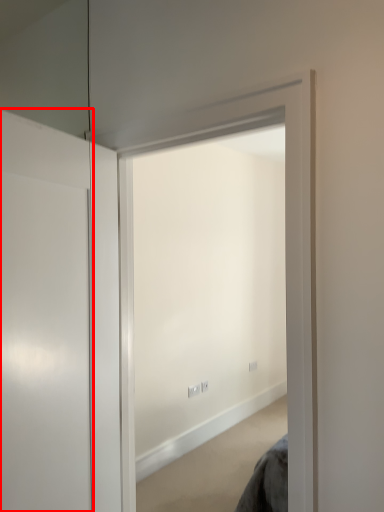
Question: From the image's perspective, what is the correct spatial positioning of door (annotated by the red box) in reference to window?

Choices:
 (A) above
 (B) below

Answer: (B)